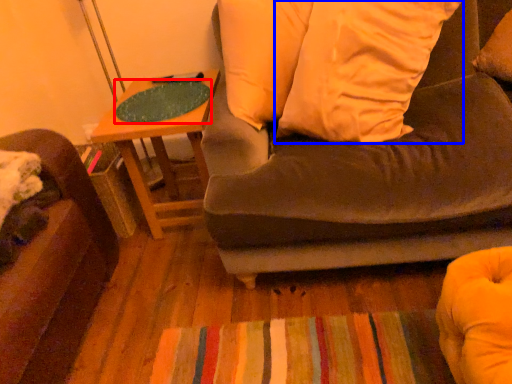
Question: Which object is closer to the camera taking this photo, table top (highlighted by a red box) or pillow (highlighted by a blue box)?

Choices:
 (A) table top
 (B) pillow

Answer: (B)